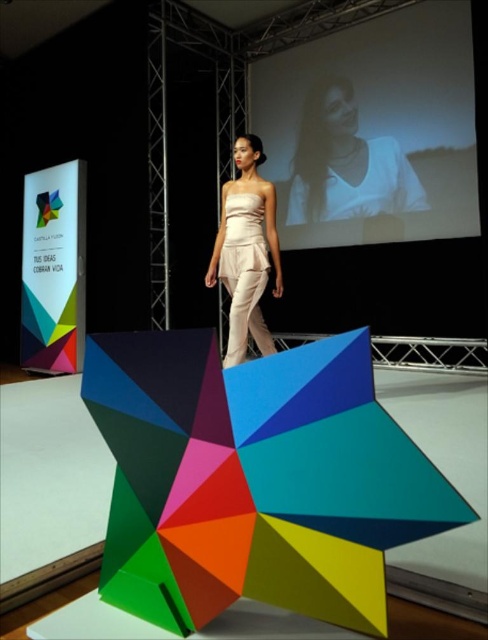
Does white matte shirt at upper center have a greater height compared to matte white dress at center?

Yes.

Who is more distant from viewer, [320,132] or [246,136]?

Positioned behind is point [320,132].

The width and height of the screenshot is (488, 640). I want to click on white matte shirt at upper center, so click(x=345, y=163).

Identify the location of white matte shirt at upper center. (345, 163).